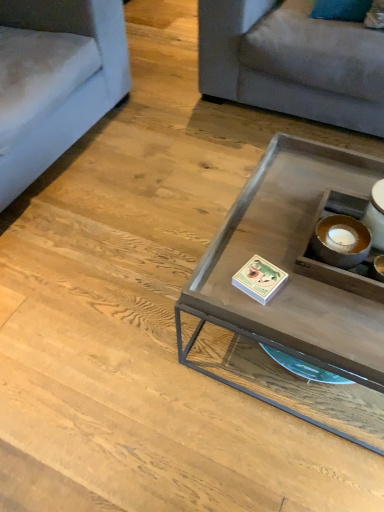
Question: Does matte glass coffee table at center come behind light gray fabric couch at upper right, which is counted as the second studio couch, starting from the left?

Choices:
 (A) yes
 (B) no

Answer: (B)

Question: Is matte glass coffee table at center positioned with its back to light gray fabric couch at upper right, the 1th studio couch from the right?

Choices:
 (A) no
 (B) yes

Answer: (A)

Question: Could you tell me if matte glass coffee table at center is facing light gray fabric couch at upper right, which is counted as the second studio couch, starting from the left?

Choices:
 (A) no
 (B) yes

Answer: (B)

Question: From a real-world perspective, is matte glass coffee table at center on top of light gray fabric couch at upper right, the 1th studio couch from the right?

Choices:
 (A) yes
 (B) no

Answer: (B)

Question: Considering the relative sizes of matte glass coffee table at center and light gray fabric couch at upper right, the 1th studio couch from the right, in the image provided, is matte glass coffee table at center wider than light gray fabric couch at upper right, the 1th studio couch from the right,?

Choices:
 (A) no
 (B) yes

Answer: (A)

Question: In terms of height, does light blue fabric couch at left, which is the second studio couch in right-to-left order, look taller or shorter compared to matte glass coffee table at center?

Choices:
 (A) tall
 (B) short

Answer: (A)

Question: Looking at the image, does light blue fabric couch at left, which is the second studio couch in right-to-left order, seem bigger or smaller compared to matte glass coffee table at center?

Choices:
 (A) small
 (B) big

Answer: (B)

Question: Looking at their shapes, would you say light blue fabric couch at left, which is the second studio couch in right-to-left order, is wider or thinner than matte glass coffee table at center?

Choices:
 (A) thin
 (B) wide

Answer: (B)

Question: Is point (117, 67) closer or farther from the camera than point (301, 192)?

Choices:
 (A) closer
 (B) farther

Answer: (B)

Question: Considering the positions of light gray fabric couch at upper right, the 1th studio couch from the right, and matte glass coffee table at center in the image, is light gray fabric couch at upper right, the 1th studio couch from the right, taller or shorter than matte glass coffee table at center?

Choices:
 (A) short
 (B) tall

Answer: (B)

Question: Is light gray fabric couch at upper right, which is counted as the second studio couch, starting from the left, in front of or behind matte glass coffee table at center in the image?

Choices:
 (A) front
 (B) behind

Answer: (B)

Question: Looking at their shapes, would you say light gray fabric couch at upper right, the 1th studio couch from the right, is wider or thinner than matte glass coffee table at center?

Choices:
 (A) thin
 (B) wide

Answer: (B)

Question: Looking at the image, does light gray fabric couch at upper right, which is counted as the second studio couch, starting from the left, seem bigger or smaller compared to matte glass coffee table at center?

Choices:
 (A) big
 (B) small

Answer: (A)

Question: From the image's perspective, is matte glass coffee table at center above or below light gray fabric couch at upper right, the 1th studio couch from the right?

Choices:
 (A) above
 (B) below

Answer: (B)

Question: Is point (359, 391) closer or farther from the camera than point (248, 46)?

Choices:
 (A) farther
 (B) closer

Answer: (B)